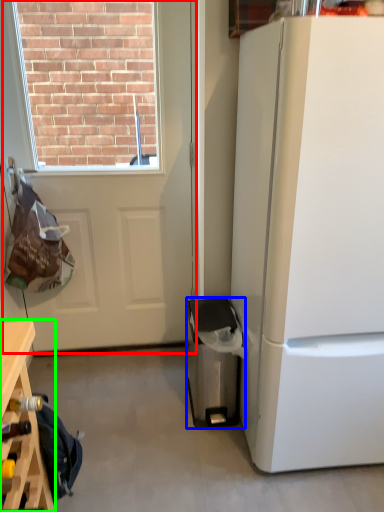
Question: Which is farther away from door (highlighted by a red box)? trash bin/can (highlighted by a blue box) or table (highlighted by a green box)?

Choices:
 (A) trash bin/can
 (B) table

Answer: (B)